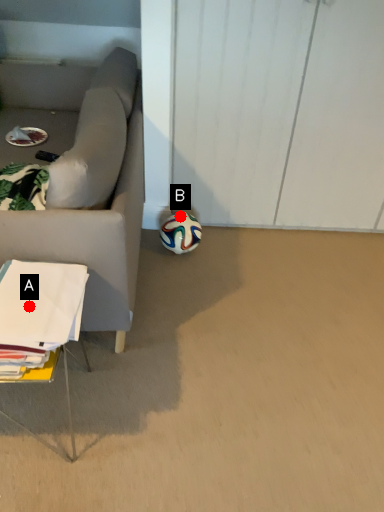
Question: Two points are circled on the image, labeled by A and B beside each circle. Which point is further to the camera?

Choices:
 (A) A is further
 (B) B is further

Answer: (B)